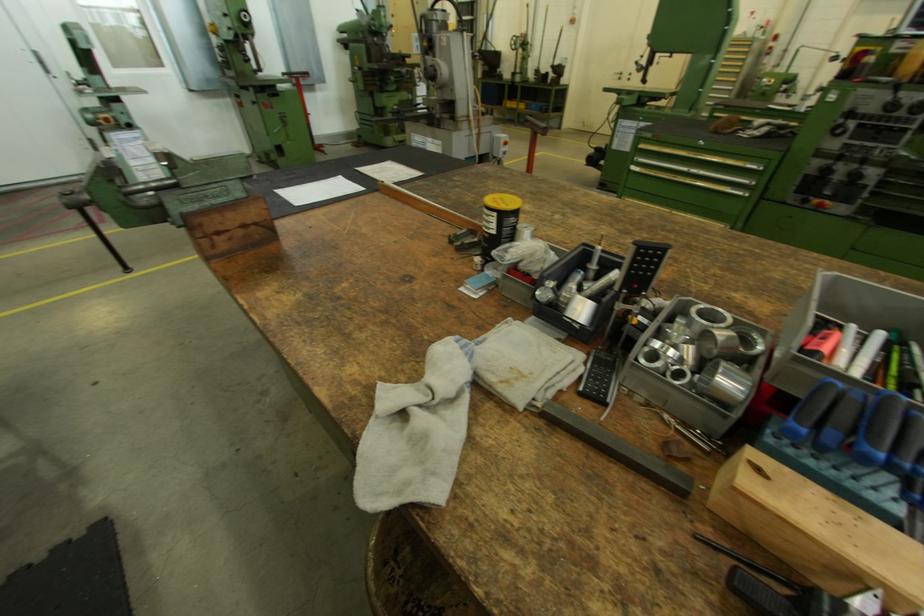
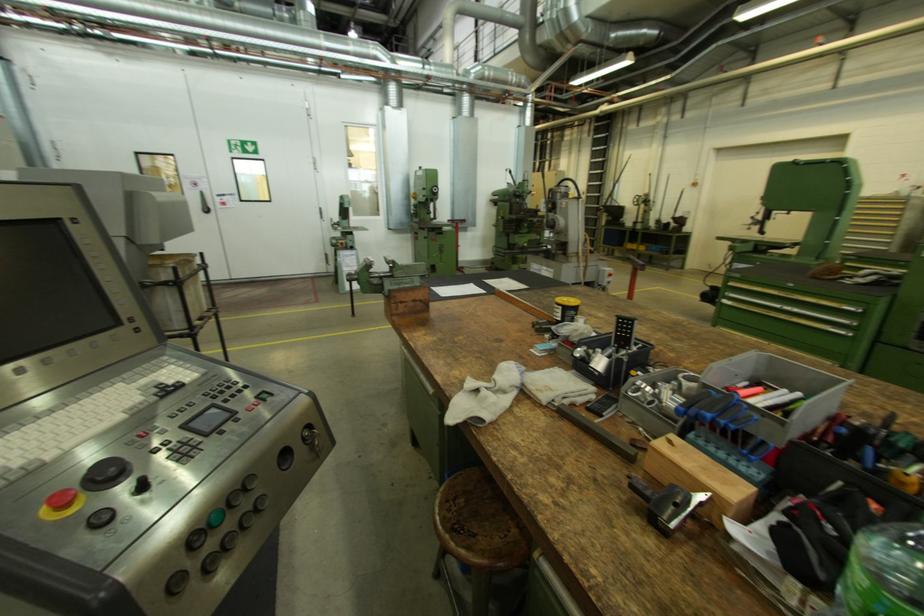
First-person continuous shooting, in which direction is the camera rotating?

The camera's rotation is toward left-up.